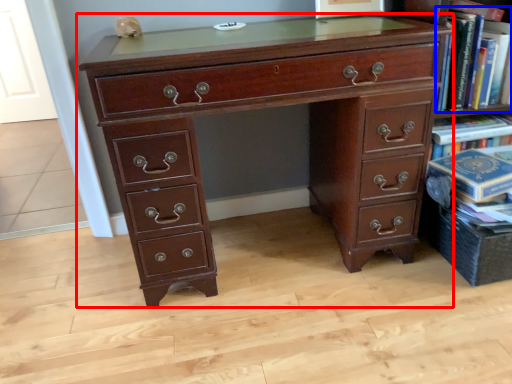
Question: Which of the following is the closest to the observer, chest of drawers (highlighted by a red box) or book (highlighted by a blue box)?

Choices:
 (A) chest of drawers
 (B) book

Answer: (A)